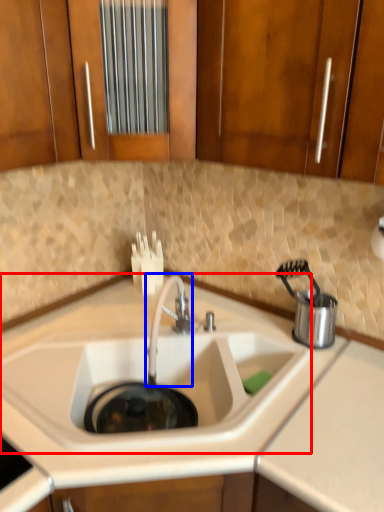
Question: Which object is further to the camera taking this photo, sink (highlighted by a red box) or tap (highlighted by a blue box)?

Choices:
 (A) sink
 (B) tap

Answer: (B)